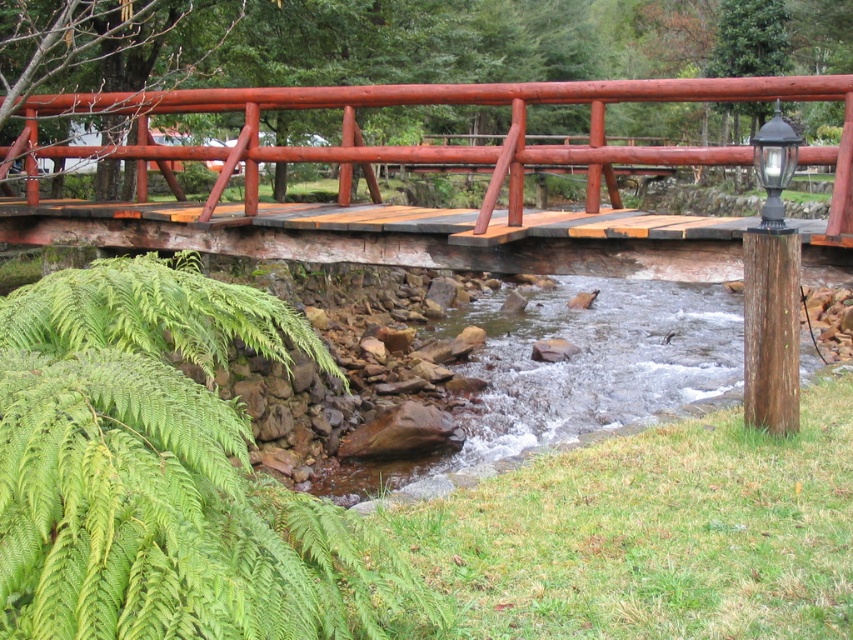
You are a hiker carrying a backpack that is 1.8 meters long. You want to cross the rustic wooden bridge and need to place your backpack on the ground near the green leafy fern at lower left. Is there enough space between the backpack and the bridge railing to safely place it there?

The distance between the backpack and the bridge railing is 1.77 meters. Since the backpack is 1.8 meters long, it would not fit within that space. You should find a wider area to place your backpack safely.

You are standing at the point with coordinates (x=445, y=145) in the image. Based on the scene description, what object are you most likely standing on?

The point (x=445, y=145) corresponds to the rustic wood bridge at center, so you are most likely standing on the rustic wood bridge at center.

You are standing on the path leading to the rustic wood bridge at center and notice a green leafy fern at lower left growing nearby. Which object is closer to you as you approach the bridge?

The green leafy fern at lower left is closer to you than the rustic wood bridge at center as you approach the bridge.